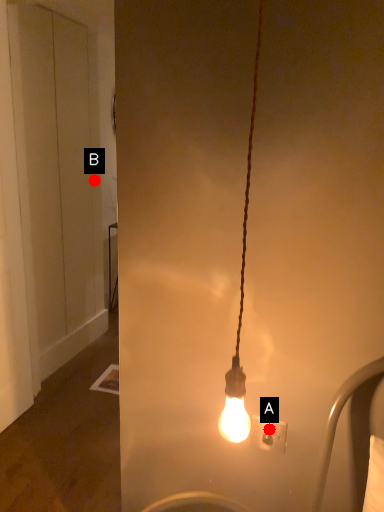
Question: Two points are circled on the image, labeled by A and B beside each circle. Which point is farther from the camera taking this photo?

Choices:
 (A) A is further
 (B) B is further

Answer: (B)